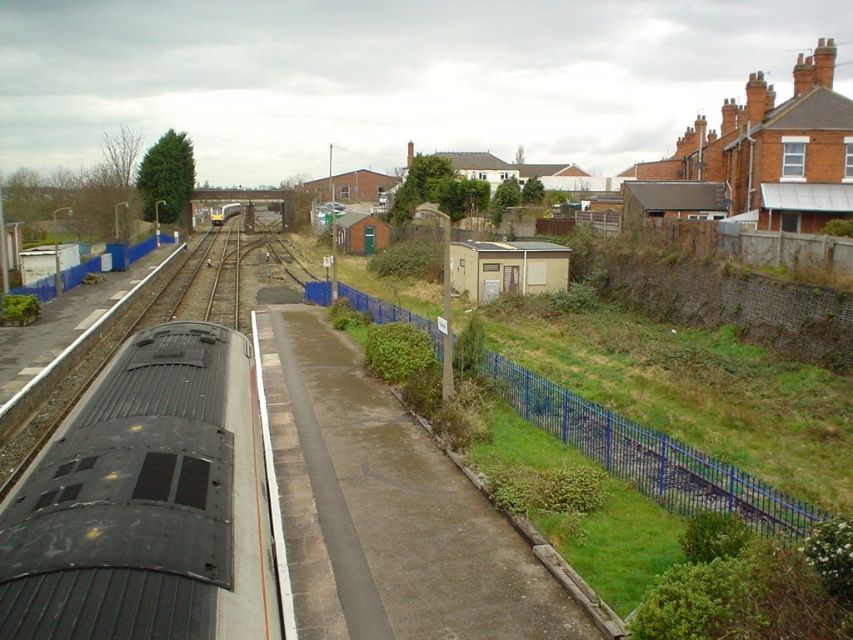
Does point (225, 625) come behind point (376, 316)?

No, it is in front of (376, 316).

Is matte black train at left bigger than blue metal fence at center-right?

No, matte black train at left is not bigger than blue metal fence at center-right.

Locate an element on the screen. This screenshot has height=640, width=853. matte black train at left is located at coordinates (148, 502).